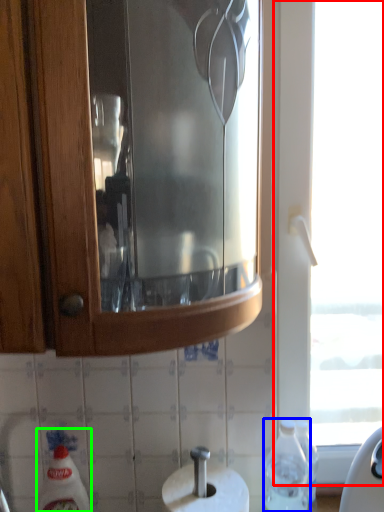
Question: Estimate the real-world distances between objects in this image. Which object is farther from window (highlighted by a red box), bottle (highlighted by a blue box) or cleaning product (highlighted by a green box)?

Choices:
 (A) bottle
 (B) cleaning product

Answer: (B)